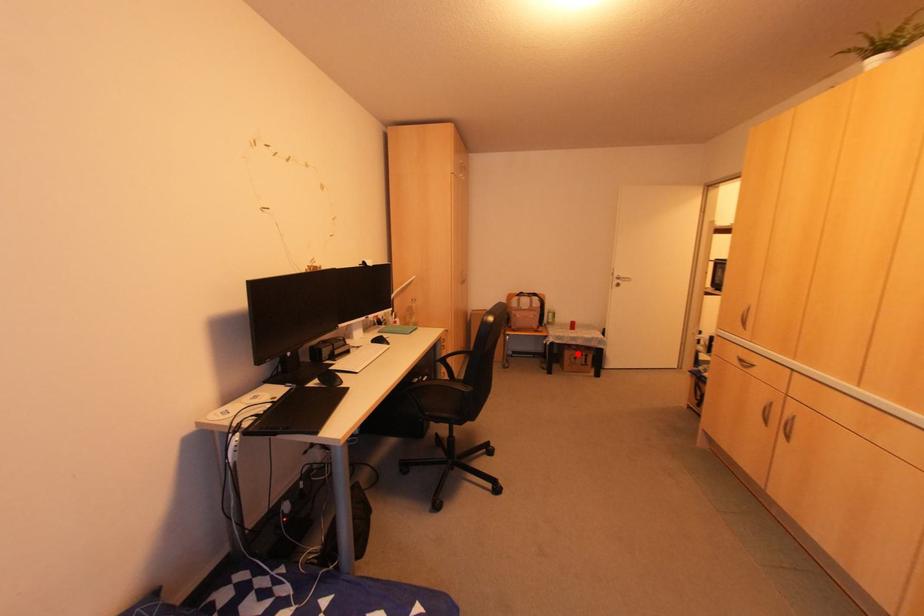
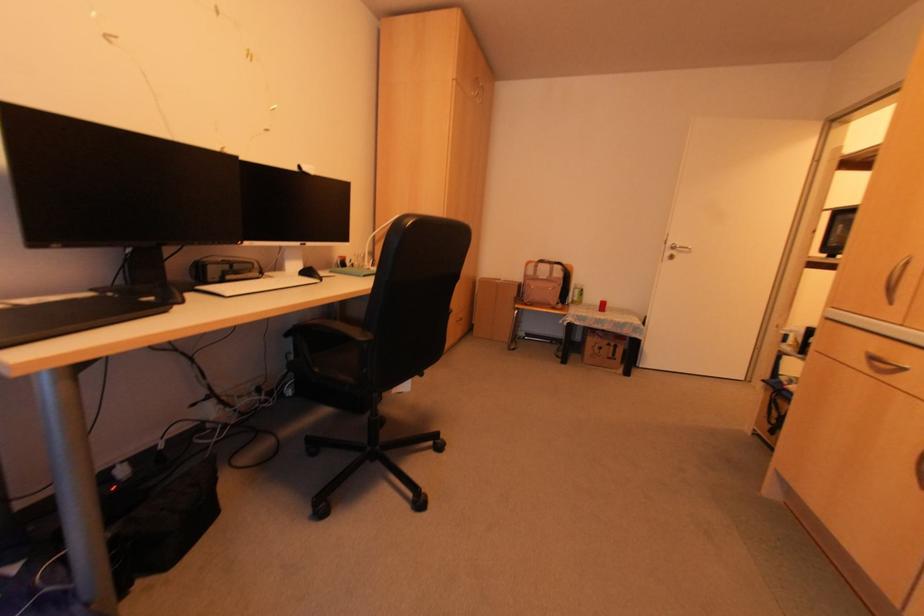
Question: I am providing you with two images of the same scene from different viewpoints. A red point is marked on the first image. Is the red point's position out of view in image 2?

Choices:
 (A) Yes
 (B) No

Answer: (B)